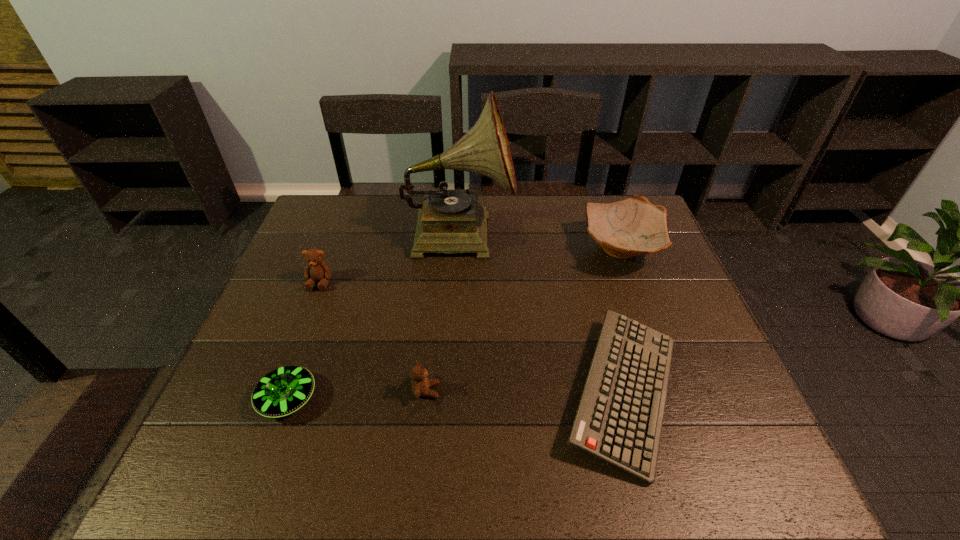
You are a GUI agent. You are given a task and a screenshot of the screen. Output one action in this format:
    pyautogui.click(x=<x>, y=<y>)
    Task: Click on the vacant space located on the back of the saucer
    
    Given the screenshot: What is the action you would take?
    pyautogui.click(x=315, y=324)

Locate an element on the screen. vacant space situated on the back of the shortest object is located at coordinates (600, 303).

What are the coordinates of `record player that is at the far edge` in the screenshot? It's located at (449, 221).

The width and height of the screenshot is (960, 540). I want to click on pottery located at the far edge, so click(634, 226).

You are a GUI agent. You are given a task and a screenshot of the screen. Output one action in this format:
    pyautogui.click(x=<x>, y=<y>)
    Task: Click on the object present at the near edge
    
    Given the screenshot: What is the action you would take?
    click(x=619, y=419)

Locate an element on the screen. teddy bear present at the left edge is located at coordinates (317, 270).

Find the location of a particular element. The height and width of the screenshot is (540, 960). saucer at the left edge is located at coordinates (284, 390).

This screenshot has height=540, width=960. In order to click on pottery that is at the right edge in this screenshot , I will do `click(634, 226)`.

Locate an element on the screen. computer keyboard located at the right edge is located at coordinates (619, 419).

This screenshot has height=540, width=960. Identify the location of object at the far right corner. [x=634, y=226].